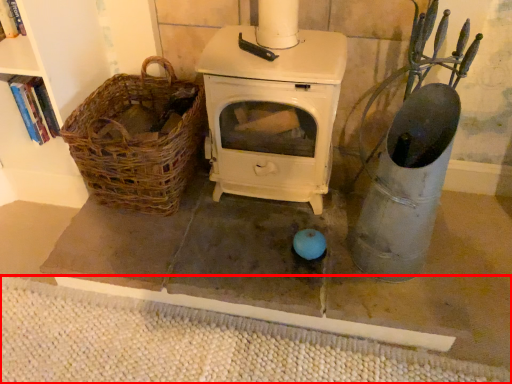
Question: From the image's perspective, considering the relative positions of mat (annotated by the red box) and basket in the image provided, where is mat (annotated by the red box) located with respect to the staircase?

Choices:
 (A) below
 (B) above

Answer: (A)